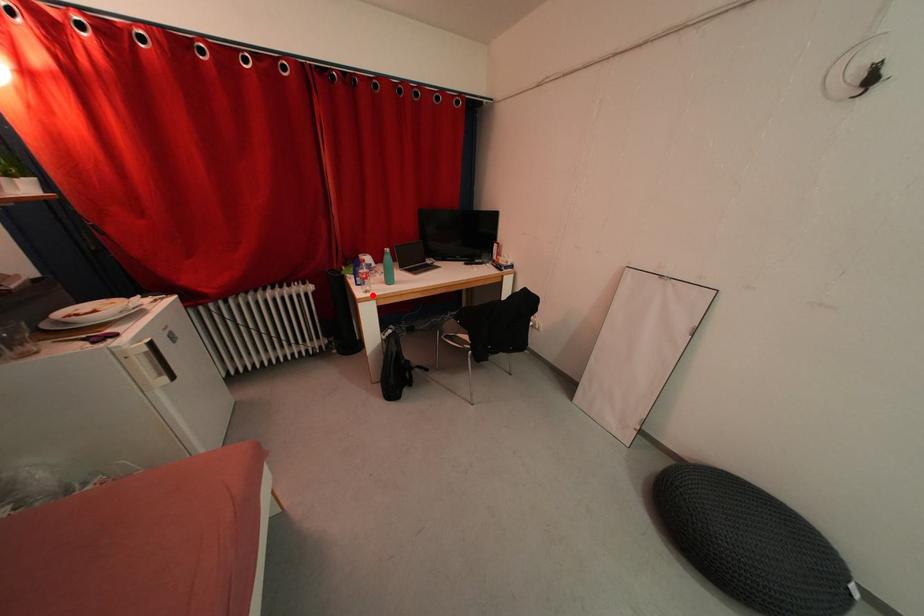
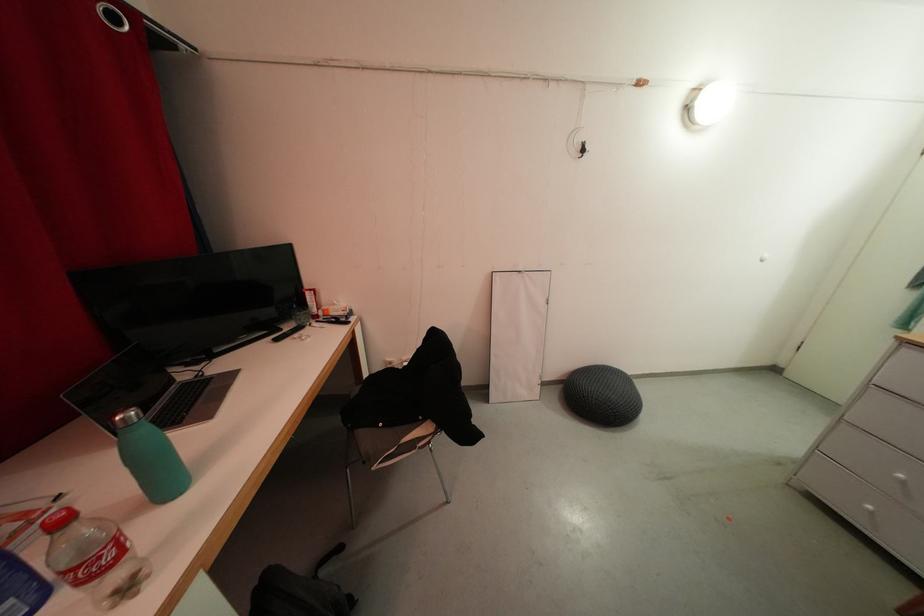
Question: I am providing you with two images of the same scene from different viewpoints. A red point is marked on the first image. At the location where the point appears in image 1, is it still visible in image 2?

Choices:
 (A) Yes
 (B) No

Answer: (A)